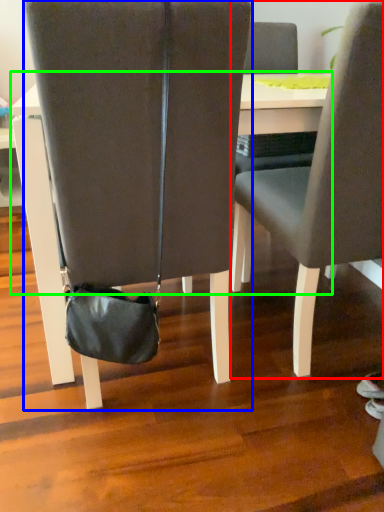
Question: Which object is the farthest from chair (highlighted by a red box)? Choose among these: chair (highlighted by a blue box) or table (highlighted by a green box).

Choices:
 (A) chair
 (B) table

Answer: (A)